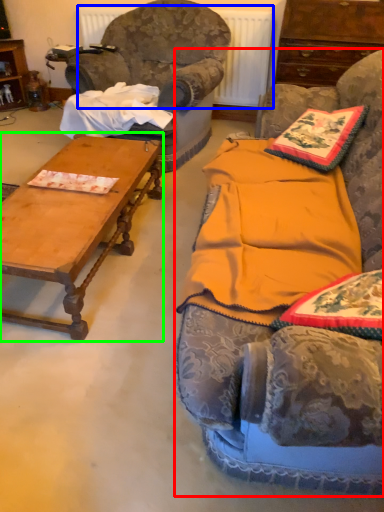
Question: Which object is the closest to the studio couch (highlighted by a red box)? Choose among these: radiator (highlighted by a blue box) or coffee table (highlighted by a green box).

Choices:
 (A) radiator
 (B) coffee table

Answer: (B)